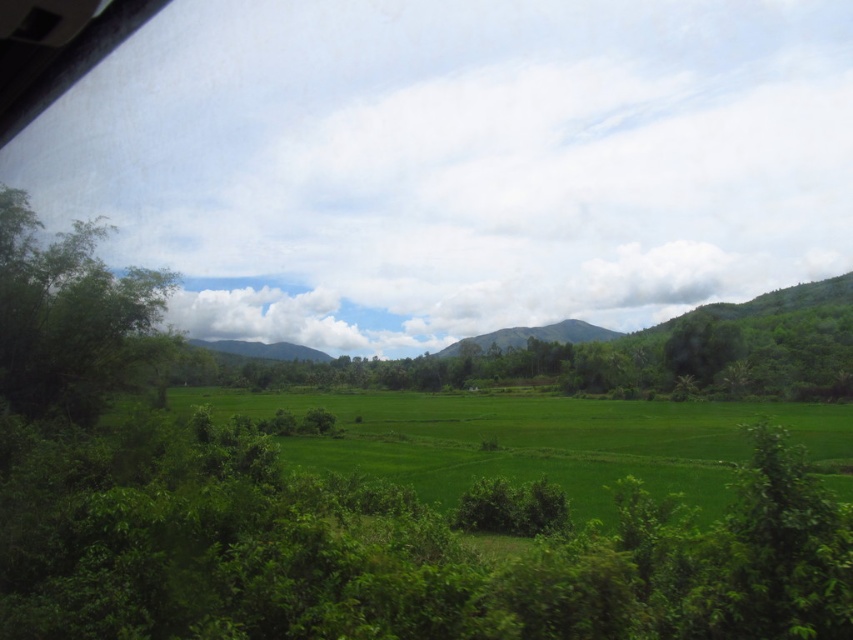
You are standing in the rural landscape and want to walk from the green leafy tree at left to the green grassy field at center. Which direction should you move relative to the tree?

You should move downward from the green leafy tree at left to reach the green grassy field at center since the green grassy field at center is located below the tree.

You are standing at the point labeled point (534, 440) in the image. What do you see around you?

You are standing in the green grassy field at center.